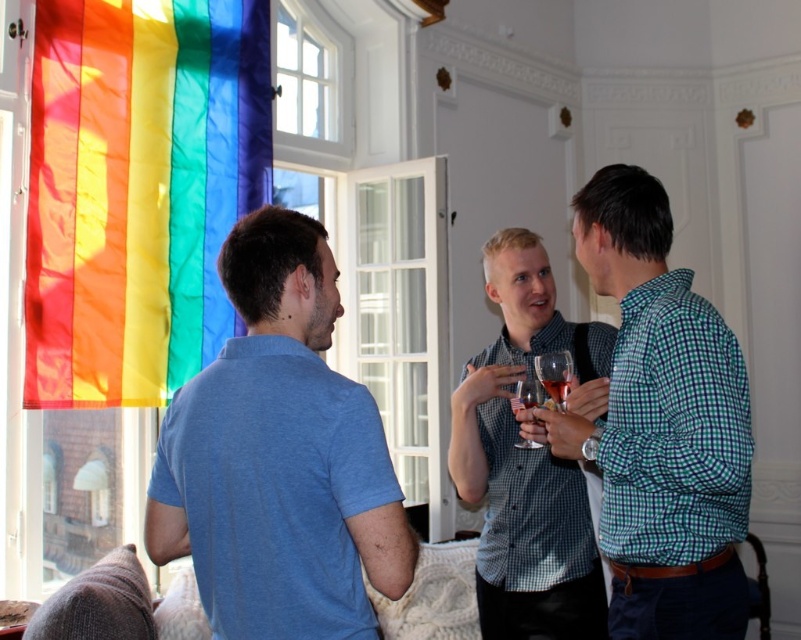
Is rainbow fabric flag at left positioned at the back of checkered fabric shirt at center?

Yes.

Does point (224, 308) lie in front of point (592, 348)?

That is False.

You are a GUI agent. You are given a task and a screenshot of the screen. Output one action in this format:
    pyautogui.click(x=<x>, y=<y>)
    Task: Click on the rainbow fabric flag at left
    The height and width of the screenshot is (640, 801).
    Given the screenshot: What is the action you would take?
    pyautogui.click(x=139, y=189)

Locate an element on the screen. rainbow fabric flag at left is located at coordinates (139, 189).

Can you confirm if translucent glass wine glass at center is positioned below clear glass wine glass at center?

Actually, translucent glass wine glass at center is above clear glass wine glass at center.

Between point (557, 390) and point (526, 388), which one is positioned behind?

Positioned behind is point (526, 388).

I want to click on translucent glass wine glass at center, so click(x=554, y=376).

Which is below, rainbow fabric flag at left or blue cotton shirt at left?

blue cotton shirt at left is lower down.

Does rainbow fabric flag at left appear on the left side of blue cotton shirt at left?

Yes, rainbow fabric flag at left is to the left of blue cotton shirt at left.

Describe the element at coordinates (139, 189) in the screenshot. I see `rainbow fabric flag at left` at that location.

The image size is (801, 640). In order to click on rainbow fabric flag at left in this screenshot , I will do `click(139, 189)`.